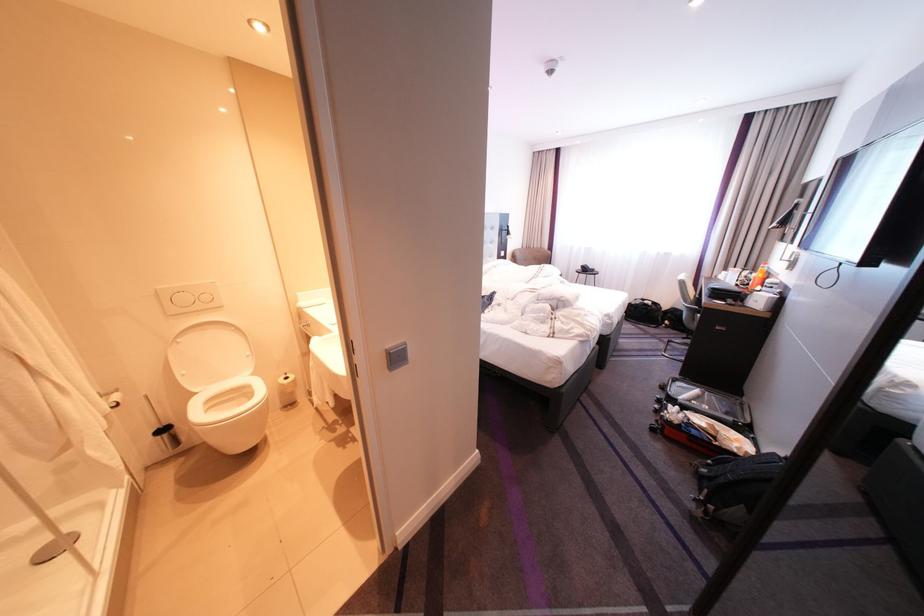
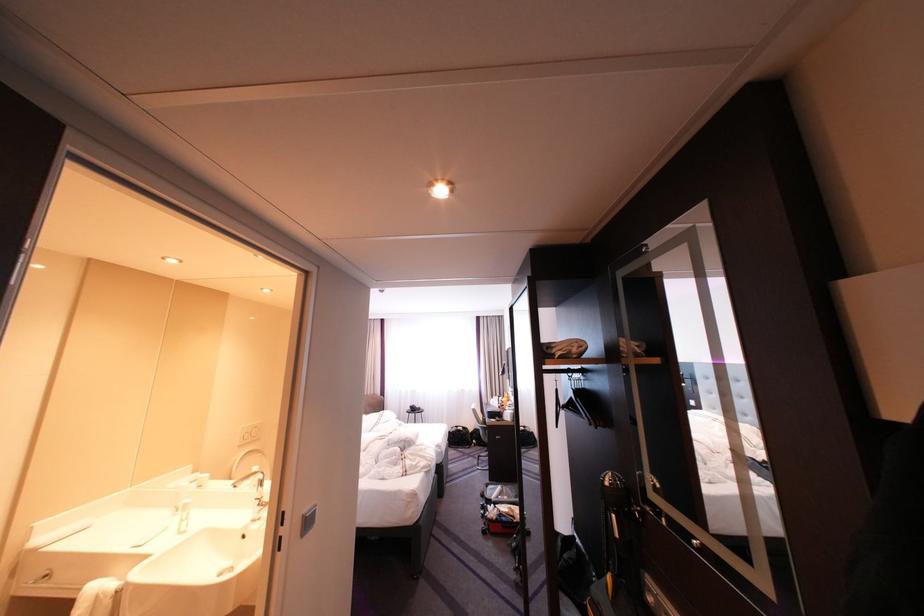
Find the pixel in the second image that matches point 697,302 in the first image.

(491, 424)